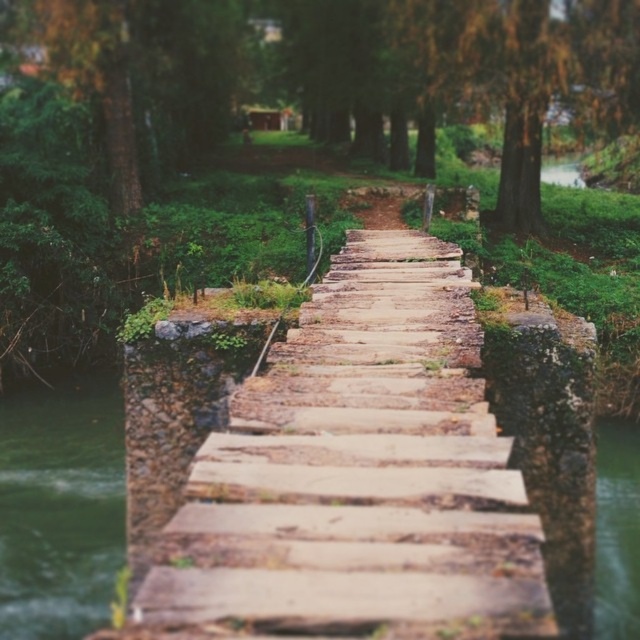
You are a hiker carrying a 20cm wide backpack. You want to cross the weathered wood path at center. Can your backpack fit through the path? Please explain using the path and green liquid at lower left.

The weathered wood path at center is thinner than the green liquid at lower left. Since the path is narrower than the liquid, and your backpack is 20cm wide, you need to check the path width. If the green liquid at lower left is wider than 20cm, then the path might be too narrow. However, without exact measurements, it is uncertain. But according to the description, the path is thinner than the liquid, so if the liquid is wider than 20cm, the path could still be sufficient. However, since the path is stated

You are standing at the entrance of the bridge and want to walk towards the weathered wood path at center. Based on the coordinates provided, in which direction should you move relative to your current position?

Since the weathered wood path at center is located at coordinates point (358, 474), you should move towards the center of the bridge to reach it.

You are a hiker carrying a heavy backpack and need to cross the weathered wood path at center. The green liquid at lower left is nearby. Which one is wider so you can safely walk on it?

The green liquid at lower left is wider than the weathered wood path at center, so it is safer to walk on the weathered wood path at center since it is solid ground.